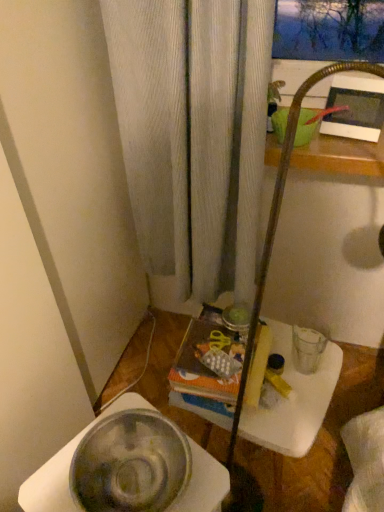
I want to click on blank space situated above clear plastic table at center (from a real-world perspective), so click(x=289, y=375).